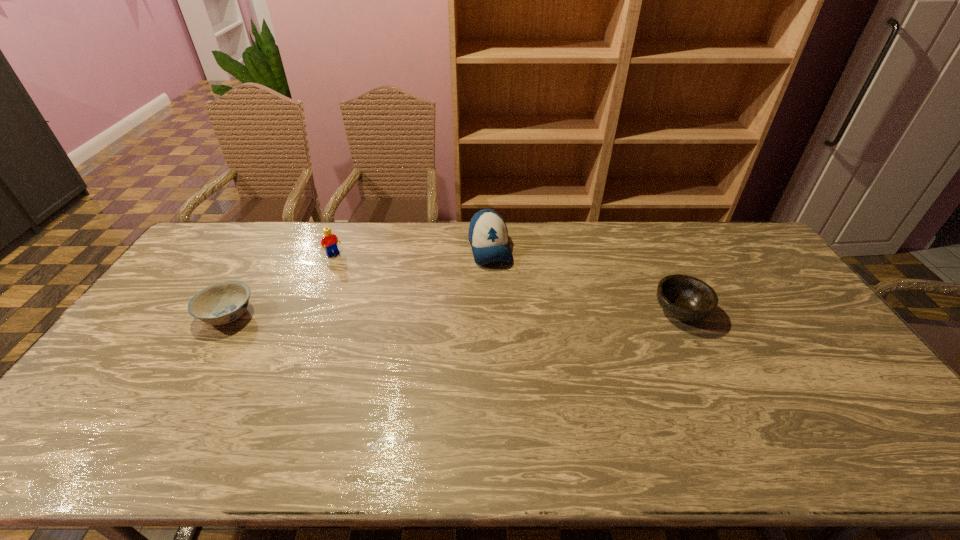
The height and width of the screenshot is (540, 960). I want to click on object that is the second nearest to the rightmost object, so click(x=330, y=240).

Where is `the third closest object relative to the second object from right to left`? Image resolution: width=960 pixels, height=540 pixels. the third closest object relative to the second object from right to left is located at coordinates (224, 302).